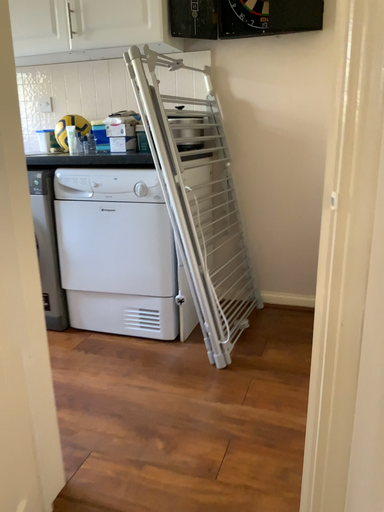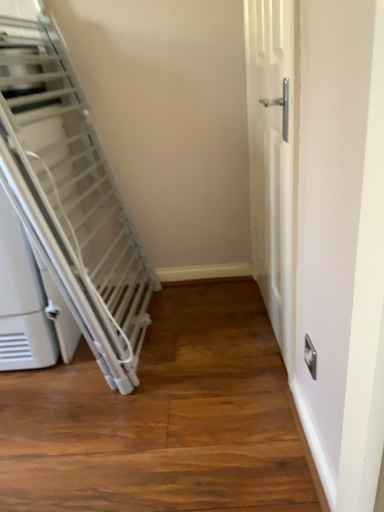
Question: Which way did the camera rotate in the video?

Choices:
 (A) rotated left
 (B) rotated right

Answer: (B)